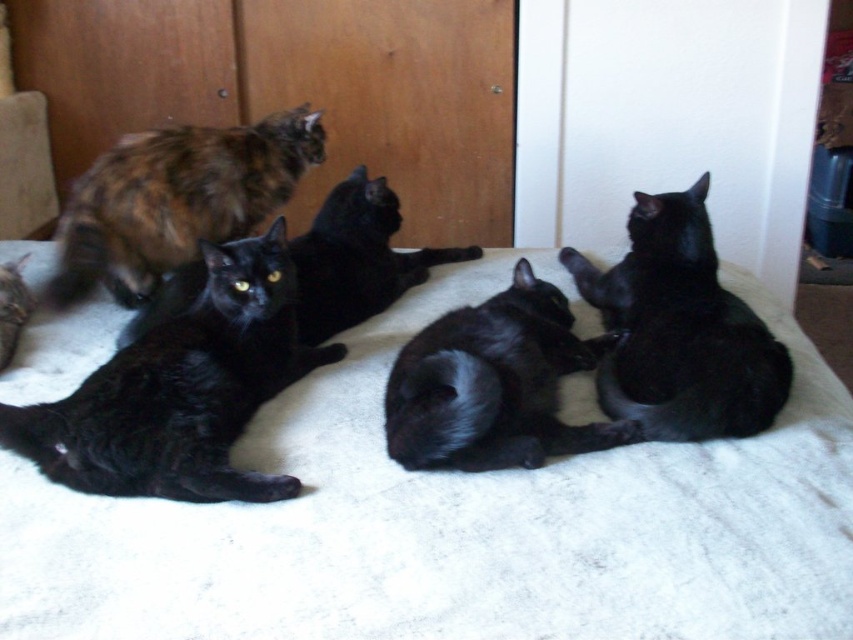
You are a cat owner who wants to place a small toy between the shiny black cat at left and the black glossy cat at center. Which cat is taller so you can place the toy accordingly?

The shiny black cat at left is taller than the black glossy cat at center, so you should place the toy near the shiny black cat at left.

You are a cat owner who wants to ensure all your cats have enough space to rest comfortably. Given the white soft bed at center and the shiny black cat at lower left, can you determine if the bed is big enough for the cat to stretch out completely?

The white soft bed at center is larger in size than the shiny black cat at lower left, so yes, the bed is big enough for the cat to stretch out completely.